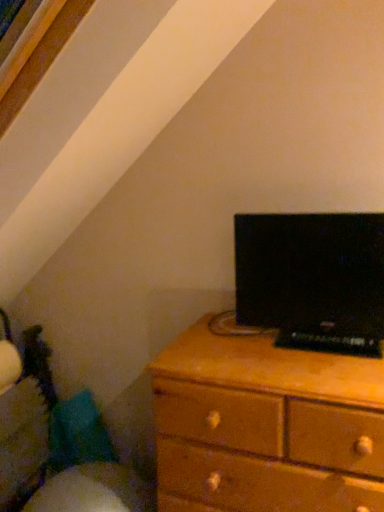
This screenshot has width=384, height=512. What do you see at coordinates (265, 425) in the screenshot?
I see `wooden chest of drawers at lower right` at bounding box center [265, 425].

Find the location of a particular element. The image size is (384, 512). wooden chest of drawers at lower right is located at coordinates (265, 425).

What do you see at coordinates (312, 279) in the screenshot? I see `black glossy monitor at upper right` at bounding box center [312, 279].

Based on the photo, what is the approximate height of black glossy monitor at upper right?

black glossy monitor at upper right is 15.21 inches in height.

Where is `black glossy monitor at upper right`? black glossy monitor at upper right is located at coordinates (312, 279).

The height and width of the screenshot is (512, 384). I want to click on wooden chest of drawers at lower right, so pyautogui.click(x=265, y=425).

Can you confirm if wooden chest of drawers at lower right is positioned to the left of black glossy monitor at upper right?

Yes, wooden chest of drawers at lower right is to the left of black glossy monitor at upper right.

Relative to black glossy monitor at upper right, is wooden chest of drawers at lower right in front or behind?

Visually, wooden chest of drawers at lower right is located in front of black glossy monitor at upper right.

Is point (311, 359) positioned before point (319, 327)?

Yes, point (311, 359) is in front of point (319, 327).

From the image's perspective, between wooden chest of drawers at lower right and black glossy monitor at upper right, which one is located above?

black glossy monitor at upper right, from the image's perspective.

From a real-world perspective, which is physically above, wooden chest of drawers at lower right or black glossy monitor at upper right?

black glossy monitor at upper right is physically above.

Considering the sizes of wooden chest of drawers at lower right and black glossy monitor at upper right in the image, is wooden chest of drawers at lower right wider or thinner than black glossy monitor at upper right?

Clearly, wooden chest of drawers at lower right has more width compared to black glossy monitor at upper right.

Looking at this image, considering the relative sizes of wooden chest of drawers at lower right and black glossy monitor at upper right in the image provided, is wooden chest of drawers at lower right shorter than black glossy monitor at upper right?

Incorrect, the height of wooden chest of drawers at lower right does not fall short of that of black glossy monitor at upper right.

Considering the sizes of wooden chest of drawers at lower right and black glossy monitor at upper right in the image, is wooden chest of drawers at lower right bigger or smaller than black glossy monitor at upper right?

wooden chest of drawers at lower right is bigger than black glossy monitor at upper right.

Can we say wooden chest of drawers at lower right lies outside black glossy monitor at upper right?

wooden chest of drawers at lower right is positioned outside black glossy monitor at upper right.

Is wooden chest of drawers at lower right next to black glossy monitor at upper right?

No, wooden chest of drawers at lower right is not touching black glossy monitor at upper right.

Could you tell me if wooden chest of drawers at lower right is turned towards black glossy monitor at upper right?

No.

How different are the orientations of wooden chest of drawers at lower right and black glossy monitor at upper right in degrees?

0.00364 degrees separate the facing orientations of wooden chest of drawers at lower right and black glossy monitor at upper right.

Identify the location of the chest of drawers below the black glossy monitor at upper right (from a real-world perspective). (265, 425).

Is black glossy monitor at upper right to the left of wooden chest of drawers at lower right from the viewer's perspective?

Incorrect, black glossy monitor at upper right is not on the left side of wooden chest of drawers at lower right.

Does black glossy monitor at upper right come behind wooden chest of drawers at lower right?

Yes, the depth of black glossy monitor at upper right is greater than that of wooden chest of drawers at lower right.

Is point (295, 240) positioned after point (189, 501)?

Yes, point (295, 240) is behind point (189, 501).

Looking at this image, from the image's perspective, is black glossy monitor at upper right located above wooden chest of drawers at lower right?

Yes, from the image's perspective, black glossy monitor at upper right is over wooden chest of drawers at lower right.

From a real-world perspective, is black glossy monitor at upper right positioned above or below wooden chest of drawers at lower right?

black glossy monitor at upper right is above wooden chest of drawers at lower right.

Which object is thinner, black glossy monitor at upper right or wooden chest of drawers at lower right?

With smaller width is black glossy monitor at upper right.

Is black glossy monitor at upper right shorter than wooden chest of drawers at lower right?

Correct, black glossy monitor at upper right is not as tall as wooden chest of drawers at lower right.

Who is bigger, black glossy monitor at upper right or wooden chest of drawers at lower right?

Bigger between the two is wooden chest of drawers at lower right.

Based on the photo, do you think black glossy monitor at upper right is within wooden chest of drawers at lower right, or outside of it?

black glossy monitor at upper right is outside wooden chest of drawers at lower right.

Is black glossy monitor at upper right placed right next to wooden chest of drawers at lower right?

There is a gap between black glossy monitor at upper right and wooden chest of drawers at lower right.

Could you tell me if black glossy monitor at upper right is turned towards wooden chest of drawers at lower right?

No, black glossy monitor at upper right is not aimed at wooden chest of drawers at lower right.

How many degrees apart are the facing directions of black glossy monitor at upper right and wooden chest of drawers at lower right?

They differ by 0.00364 degrees in their facing directions.

Where is `chest of drawers that appears on the left of black glossy monitor at upper right`? Image resolution: width=384 pixels, height=512 pixels. chest of drawers that appears on the left of black glossy monitor at upper right is located at coordinates (265, 425).

Find the location of `the chest of drawers that appears below the black glossy monitor at upper right (from the image's perspective)`. the chest of drawers that appears below the black glossy monitor at upper right (from the image's perspective) is located at coordinates (265, 425).

Find the location of `computer that is above the wooden chest of drawers at lower right (from a real-world perspective)`. computer that is above the wooden chest of drawers at lower right (from a real-world perspective) is located at coordinates (312, 279).